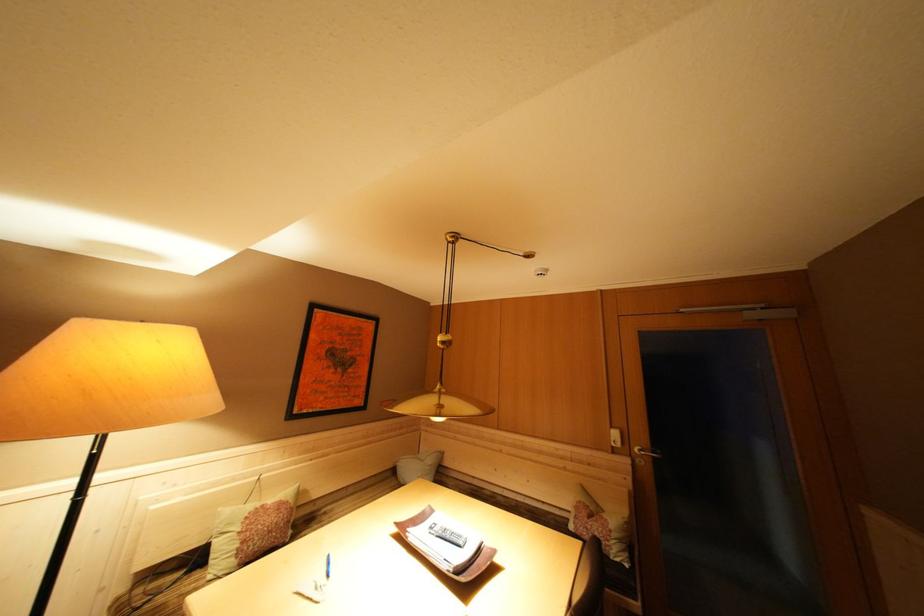
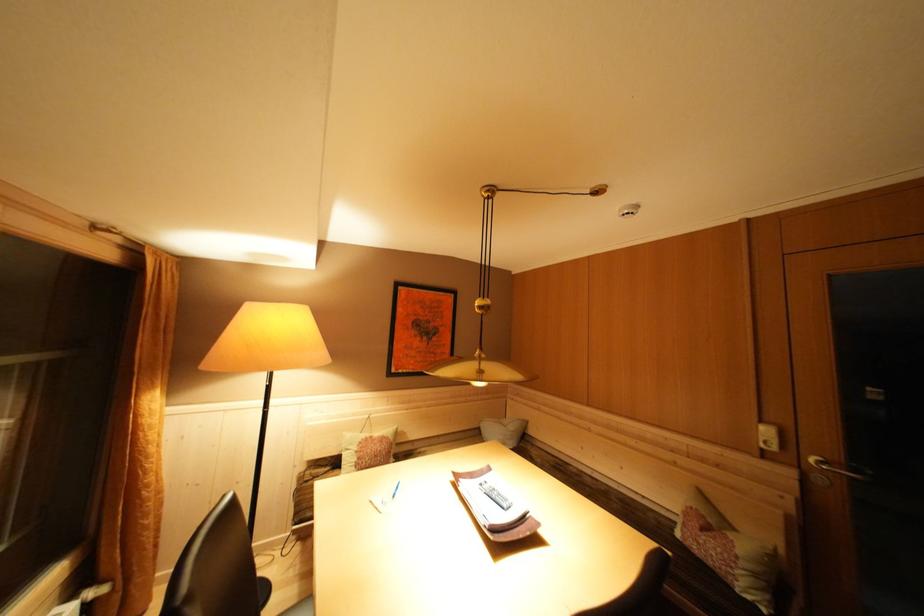
Locate, in the second image, the point that corresponds to pixel 438 533 in the first image.

(488, 488)